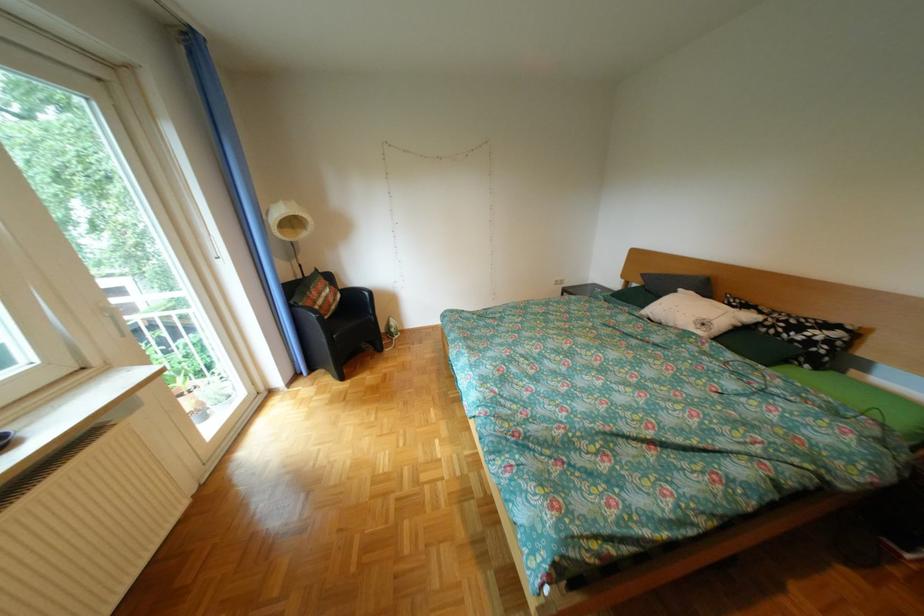
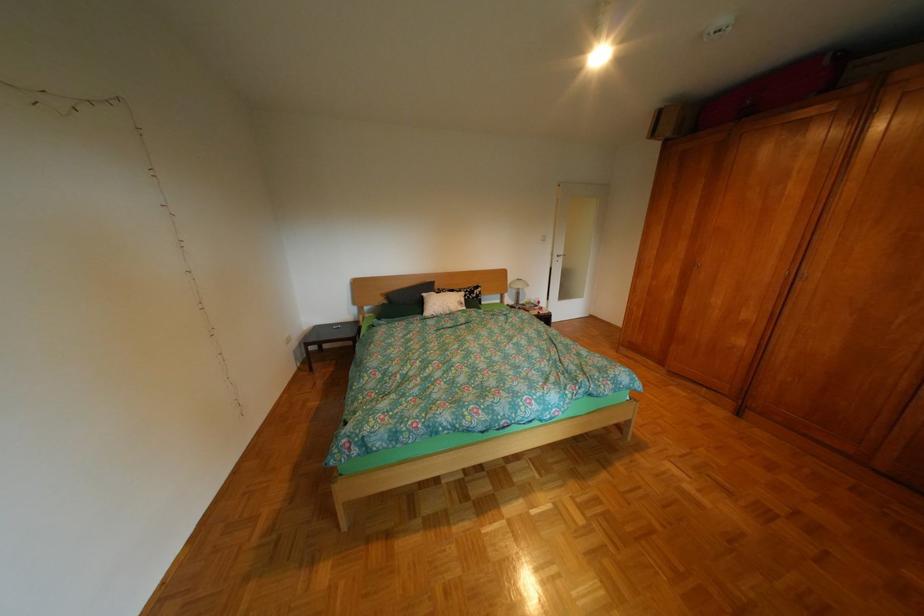
Locate, in the second image, the point that corresponds to (x=695, y=291) in the first image.

(439, 294)